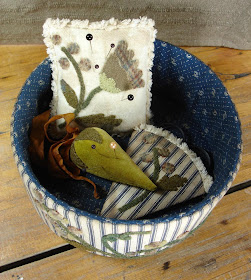
Locate an element on the screen. The width and height of the screenshot is (251, 280). blue with white dots interior fabric is located at coordinates (203, 125).